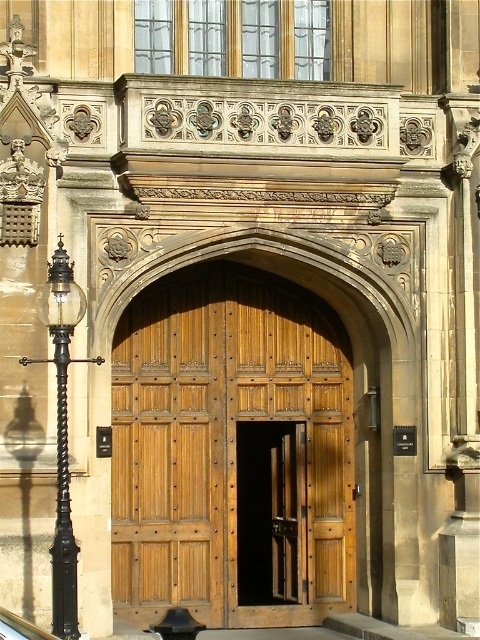
What are the coordinates of `black glass lamp post at left` in the screenshot? It's located at (62, 433).

Can you confirm if wooden panelled door at center is bigger than black glass lamp post at left?

Correct, wooden panelled door at center is larger in size than black glass lamp post at left.

Is point (235, 604) behind point (51, 337)?

Yes, it is behind point (51, 337).

Is point (112, 454) positioned behind point (48, 288)?

Yes, it is behind point (48, 288).

Locate an element on the screen. The width and height of the screenshot is (480, 640). wooden panelled door at center is located at coordinates (227, 444).

Is wooden panelled door at center smaller than black glass car at lower left?

Incorrect, wooden panelled door at center is not smaller in size than black glass car at lower left.

Is point (231, 397) closer to viewer compared to point (0, 618)?

No, (231, 397) is behind (0, 618).

Image resolution: width=480 pixels, height=640 pixels. Identify the location of wooden panelled door at center. (227, 444).